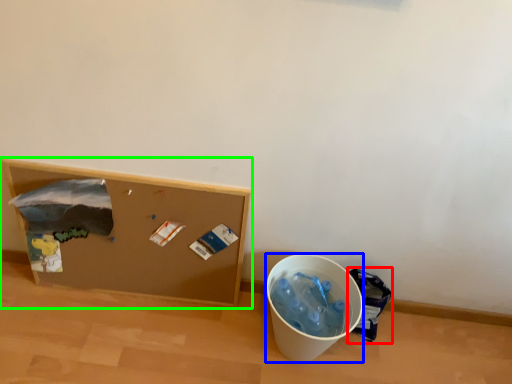
Question: Based on their relative distances, which object is farther from garbage (highlighted by a red box)? Choose from recycling bin (highlighted by a blue box) and furniture (highlighted by a green box).

Choices:
 (A) recycling bin
 (B) furniture

Answer: (B)